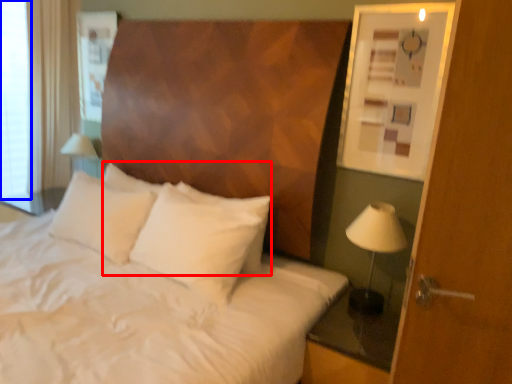
Question: Which object is closer to the camera taking this photo, pillow (highlighted by a red box) or window screen (highlighted by a blue box)?

Choices:
 (A) pillow
 (B) window screen

Answer: (A)